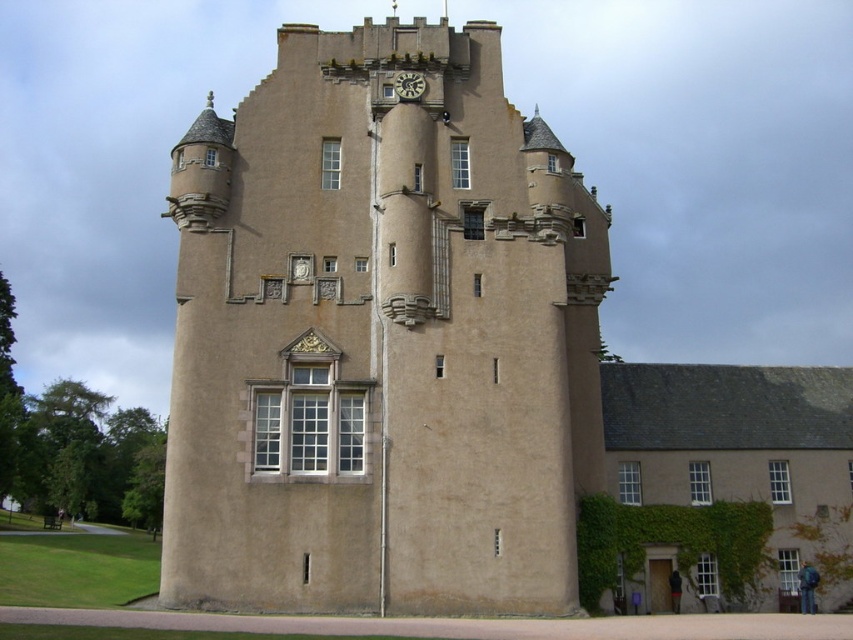
Can you confirm if beige stone tower at center is positioned above matte stone clock at upper center?

Yes.

Who is higher up, beige stone tower at center or matte stone clock at upper center?

beige stone tower at center is above.

Who is more distant from viewer, [541,595] or [396,96]?

The point [396,96] is behind.

Locate an element on the screen. This screenshot has width=853, height=640. beige stone tower at center is located at coordinates (381, 337).